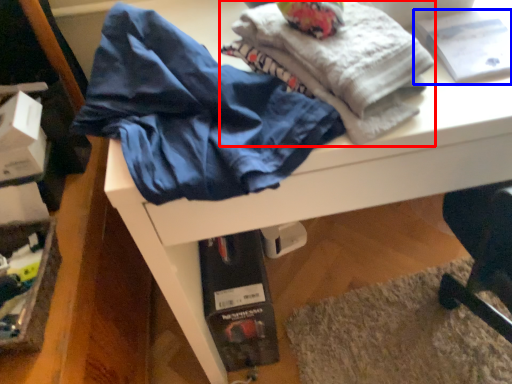
Question: Which object appears closest to the camera in this image, fabric (highlighted by a red box) or book (highlighted by a blue box)?

Choices:
 (A) fabric
 (B) book

Answer: (A)